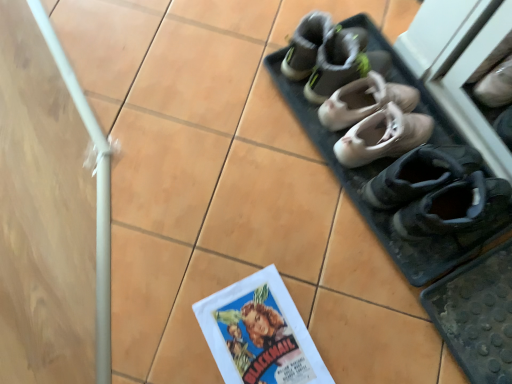
The width and height of the screenshot is (512, 384). What do you see at coordinates (364, 101) in the screenshot?
I see `light beige leather ballet flats at center, the second footwear from the top` at bounding box center [364, 101].

What is the approximate height of gray suede sneakers at upper center, arranged as the 1th footwear when viewed from the top?

gray suede sneakers at upper center, arranged as the 1th footwear when viewed from the top, is 6.79 inches in height.

What do you see at coordinates (343, 62) in the screenshot? The height and width of the screenshot is (384, 512). I see `gray suede sneakers at upper center, arranged as the 1th footwear when viewed from the top` at bounding box center [343, 62].

Locate an element on the screen. Image resolution: width=512 pixels, height=384 pixels. light beige leather ballet shoes at center, the third footwear in the bottom-to-top sequence is located at coordinates (383, 136).

You are a GUI agent. You are given a task and a screenshot of the screen. Output one action in this format:
    pyautogui.click(x=<x>, y=<y>)
    Task: Click on the matte paper comic book at lower center
    The width and height of the screenshot is (512, 384).
    Given the screenshot: What is the action you would take?
    pyautogui.click(x=259, y=333)

The height and width of the screenshot is (384, 512). What do you see at coordinates (259, 333) in the screenshot?
I see `matte paper comic book at lower center` at bounding box center [259, 333].

The width and height of the screenshot is (512, 384). What do you see at coordinates (461, 90) in the screenshot?
I see `matte gray sneakers at upper right, the 4th footwear when ordered from top to bottom` at bounding box center [461, 90].

This screenshot has width=512, height=384. Identify the location of light beige leather ballet flats at center, the second footwear from the top. (364, 101).

Who is bigger, gray suede sneakers at upper center, which is the fifth footwear in bottom-to-top order, or gray fabric shoes at upper center?

Bigger between the two is gray suede sneakers at upper center, which is the fifth footwear in bottom-to-top order.

How different are the orientations of gray suede sneakers at upper center, arranged as the 1th footwear when viewed from the top, and gray fabric shoes at upper center in degrees?

There is a 5.65-degree angle between the facing directions of gray suede sneakers at upper center, arranged as the 1th footwear when viewed from the top, and gray fabric shoes at upper center.

Based on the photo, does gray suede sneakers at upper center, arranged as the 1th footwear when viewed from the top, lie behind gray fabric shoes at upper center?

No, the depth of gray suede sneakers at upper center, arranged as the 1th footwear when viewed from the top, is less than that of gray fabric shoes at upper center.

Consider the image. Which point is more distant from viewer, (328, 55) or (384, 7)?

Point (384, 7)

What's the angular difference between light beige leather ballet shoes at center, the 3th footwear viewed from the top, and light beige leather ballet flats at center, which is counted as the 4th footwear, starting from the bottom,'s facing directions?

There is a 0-degree angle between the facing directions of light beige leather ballet shoes at center, the 3th footwear viewed from the top, and light beige leather ballet flats at center, which is counted as the 4th footwear, starting from the bottom.

From the image's perspective, does light beige leather ballet shoes at center, the third footwear in the bottom-to-top sequence, appear lower than light beige leather ballet flats at center, the second footwear from the top?

Yes, from the image's perspective, light beige leather ballet shoes at center, the third footwear in the bottom-to-top sequence, is beneath light beige leather ballet flats at center, the second footwear from the top.

Considering the positions of objects light beige leather ballet shoes at center, the 3th footwear viewed from the top, and light beige leather ballet flats at center, the second footwear from the top, in the image provided, who is more to the left, light beige leather ballet shoes at center, the 3th footwear viewed from the top, or light beige leather ballet flats at center, the second footwear from the top,?

Positioned to the left is light beige leather ballet flats at center, the second footwear from the top.

Which is more to the right, light beige leather ballet flats at center, which is counted as the 4th footwear, starting from the bottom, or matte paper comic book at lower center?

From the viewer's perspective, light beige leather ballet flats at center, which is counted as the 4th footwear, starting from the bottom, appears more on the right side.

From the image's perspective, is light beige leather ballet flats at center, which is counted as the 4th footwear, starting from the bottom, on top of matte paper comic book at lower center?

Indeed, from the image's perspective, light beige leather ballet flats at center, which is counted as the 4th footwear, starting from the bottom, is shown above matte paper comic book at lower center.

Is light beige leather ballet flats at center, the second footwear from the top, bigger than matte paper comic book at lower center?

Indeed, light beige leather ballet flats at center, the second footwear from the top, has a larger size compared to matte paper comic book at lower center.

Could matte paper comic book at lower center be considered to be inside light beige leather ballet flats at center, the second footwear from the top?

No, matte paper comic book at lower center is not a part of light beige leather ballet flats at center, the second footwear from the top.

Is point (468, 231) behind point (445, 44)?

Yes, point (468, 231) is farther from viewer.

Can we say black suede shoes at lower right, the fifth footwear from the top, lies outside matte gray sneakers at upper right, marked as the 2th footwear in a bottom-to-top arrangement?

Yes, black suede shoes at lower right, the fifth footwear from the top, is located beyond the bounds of matte gray sneakers at upper right, marked as the 2th footwear in a bottom-to-top arrangement.

From the picture: Are black suede shoes at lower right, the fifth footwear from the top, and matte gray sneakers at upper right, marked as the 2th footwear in a bottom-to-top arrangement, located far from each other?

No, black suede shoes at lower right, the fifth footwear from the top, is not far away from matte gray sneakers at upper right, marked as the 2th footwear in a bottom-to-top arrangement.

Identify the location of footwear that is the 1st one when counting rightward from the matte paper comic book at lower center. (343, 62).

Which is behind, point (224, 339) or point (361, 54)?

The point (361, 54) is more distant.

Consider the image. Is matte paper comic book at lower center in contact with gray suede sneakers at upper center, arranged as the 1th footwear when viewed from the top?

No, matte paper comic book at lower center is not making contact with gray suede sneakers at upper center, arranged as the 1th footwear when viewed from the top.

Consider the image. Which is more to the right, matte paper comic book at lower center or gray suede sneakers at upper center, arranged as the 1th footwear when viewed from the top?

From the viewer's perspective, gray suede sneakers at upper center, arranged as the 1th footwear when viewed from the top, appears more on the right side.

Considering the relative sizes of light beige leather ballet flats at center, which is counted as the 4th footwear, starting from the bottom, and gray suede sneakers at upper center, which is the fifth footwear in bottom-to-top order, in the image provided, is light beige leather ballet flats at center, which is counted as the 4th footwear, starting from the bottom, smaller than gray suede sneakers at upper center, which is the fifth footwear in bottom-to-top order,?

Yes, light beige leather ballet flats at center, which is counted as the 4th footwear, starting from the bottom, is smaller than gray suede sneakers at upper center, which is the fifth footwear in bottom-to-top order.

Which of these two, light beige leather ballet flats at center, which is counted as the 4th footwear, starting from the bottom, or gray suede sneakers at upper center, which is the fifth footwear in bottom-to-top order, stands shorter?

Standing shorter between the two is light beige leather ballet flats at center, which is counted as the 4th footwear, starting from the bottom.

From a real-world perspective, which object stands above the other?

gray suede sneakers at upper center, arranged as the 1th footwear when viewed from the top.

Can you tell me how much gray suede sneakers at upper center, arranged as the 1th footwear when viewed from the top, and black suede shoes at lower right, positioned as the 1th footwear in bottom-to-top order, differ in facing direction?

The facing directions of gray suede sneakers at upper center, arranged as the 1th footwear when viewed from the top, and black suede shoes at lower right, positioned as the 1th footwear in bottom-to-top order, are 1.51 degrees apart.

Which of these two, gray suede sneakers at upper center, arranged as the 1th footwear when viewed from the top, or black suede shoes at lower right, the fifth footwear from the top, is smaller?

With smaller size is gray suede sneakers at upper center, arranged as the 1th footwear when viewed from the top.

From a real-world perspective, is gray suede sneakers at upper center, which is the fifth footwear in bottom-to-top order, below black suede shoes at lower right, the fifth footwear from the top?

Yes.

Is there a large distance between gray suede sneakers at upper center, arranged as the 1th footwear when viewed from the top, and black suede shoes at lower right, the fifth footwear from the top?

That's not correct — gray suede sneakers at upper center, arranged as the 1th footwear when viewed from the top, is a little close to black suede shoes at lower right, the fifth footwear from the top.

What are the coordinates of `footwear that is the 1st one when counting downward from the gray fabric shoes at upper center (from the image's perspective)` in the screenshot? It's located at (343, 62).

From the light beige leather ballet shoes at center, the third footwear in the bottom-to-top sequence, count the 1st footwear to the left and point to it. Please provide its 2D coordinates.

[(364, 101)]

Based on their spatial positions, is matte paper comic book at lower center or light beige leather ballet shoes at center, the third footwear in the bottom-to-top sequence, further from black suede shoes at lower right, the fifth footwear from the top?

matte paper comic book at lower center lies further to black suede shoes at lower right, the fifth footwear from the top, than the other object.

Consider the image. From the image, which object appears to be nearer to light beige leather ballet flats at center, the second footwear from the top, matte gray sneakers at upper right, marked as the 2th footwear in a bottom-to-top arrangement, or matte paper comic book at lower center?

matte gray sneakers at upper right, marked as the 2th footwear in a bottom-to-top arrangement, is positioned closer to the anchor light beige leather ballet flats at center, the second footwear from the top.

When comparing their distances from gray suede sneakers at upper center, arranged as the 1th footwear when viewed from the top, does light beige leather ballet flats at center, which is counted as the 4th footwear, starting from the bottom, or light beige leather ballet shoes at center, the 3th footwear viewed from the top, seem further?

light beige leather ballet shoes at center, the 3th footwear viewed from the top.

Based on their spatial positions, is light beige leather ballet flats at center, the second footwear from the top, or gray fabric shoes at upper center closer to gray suede sneakers at upper center, arranged as the 1th footwear when viewed from the top?

light beige leather ballet flats at center, the second footwear from the top, lies closer to gray suede sneakers at upper center, arranged as the 1th footwear when viewed from the top, than the other object.

Estimate the real-world distances between objects in this image. Which object is further from light beige leather ballet flats at center, the second footwear from the top, matte paper comic book at lower center or black suede shoes at lower right, the fifth footwear from the top?

matte paper comic book at lower center lies further to light beige leather ballet flats at center, the second footwear from the top, than the other object.

From the image, which object appears to be nearer to black suede shoes at lower right, positioned as the 1th footwear in bottom-to-top order, gray suede sneakers at upper center, arranged as the 1th footwear when viewed from the top, or matte paper comic book at lower center?

Based on the image, gray suede sneakers at upper center, arranged as the 1th footwear when viewed from the top, appears to be nearer to black suede shoes at lower right, positioned as the 1th footwear in bottom-to-top order.

Estimate the real-world distances between objects in this image. Which object is further from gray fabric shoes at upper center, light beige leather ballet shoes at center, the 3th footwear viewed from the top, or matte gray sneakers at upper right, marked as the 2th footwear in a bottom-to-top arrangement?

light beige leather ballet shoes at center, the 3th footwear viewed from the top, is positioned further to the anchor gray fabric shoes at upper center.

Looking at the image, which one is located further to light beige leather ballet shoes at center, the 3th footwear viewed from the top, black suede shoes at lower right, the fifth footwear from the top, or matte gray sneakers at upper right, marked as the 2th footwear in a bottom-to-top arrangement?

black suede shoes at lower right, the fifth footwear from the top.

You are a GUI agent. You are given a task and a screenshot of the screen. Output one action in this format:
    pyautogui.click(x=<x>, y=<y>)
    Task: Click on the footwear between light beige leather ballet shoes at center, the 3th footwear viewed from the top, and black suede shoes at lower right, positioned as the 1th footwear in bottom-to-top order, in the up-down direction
    
    Given the screenshot: What is the action you would take?
    pyautogui.click(x=461, y=90)

Image resolution: width=512 pixels, height=384 pixels. Find the location of `footwear that lies between gray fabric shoes at upper center and light beige leather ballet flats at center, the second footwear from the top, from top to bottom`. footwear that lies between gray fabric shoes at upper center and light beige leather ballet flats at center, the second footwear from the top, from top to bottom is located at coordinates (343, 62).

Find the location of a particular element. footwear between gray suede sneakers at upper center, arranged as the 1th footwear when viewed from the top, and light beige leather ballet shoes at center, the 3th footwear viewed from the top, vertically is located at coordinates (364, 101).

This screenshot has height=384, width=512. I want to click on footwear between matte gray sneakers at upper right, marked as the 2th footwear in a bottom-to-top arrangement, and matte paper comic book at lower center, in the vertical direction, so tap(455, 209).